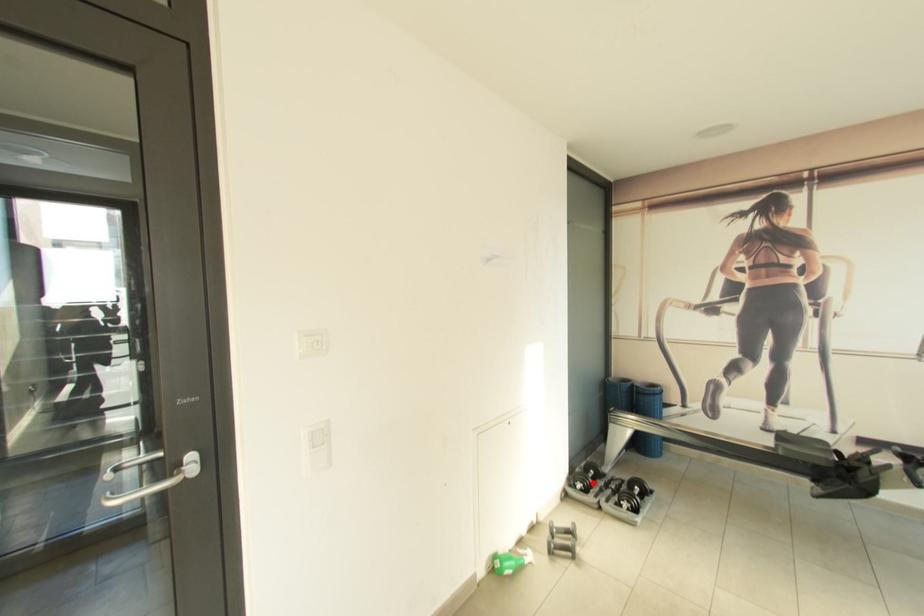
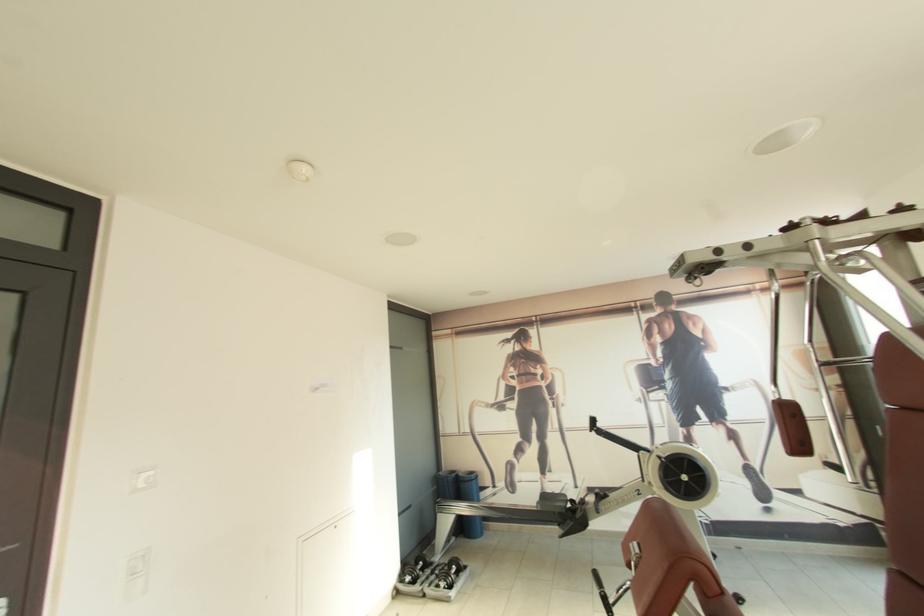
Locate, in the second image, the point that corresponds to the highlighted location in the first image.

(419, 575)